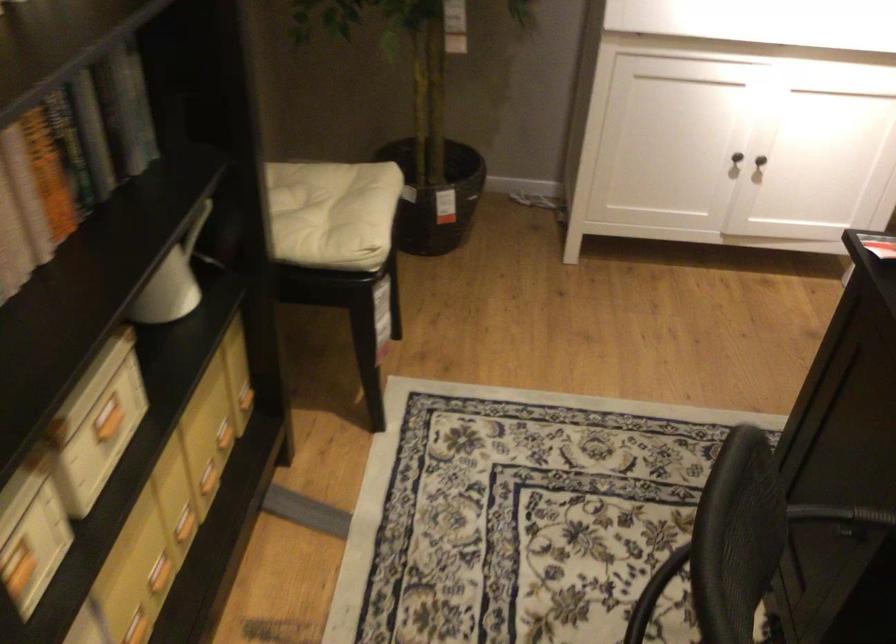
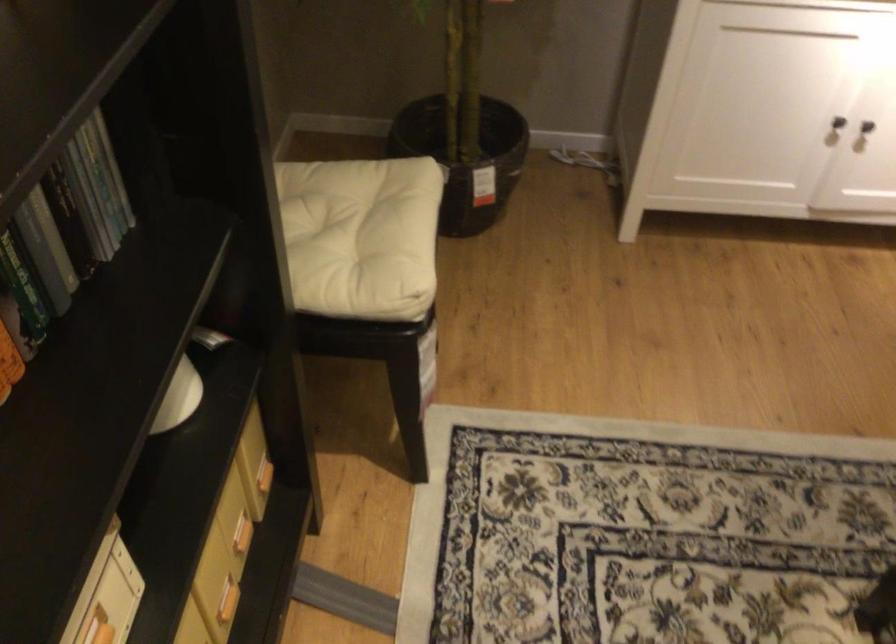
Find the pixel in the second image that matches (x=133, y=129) in the first image.

(95, 198)